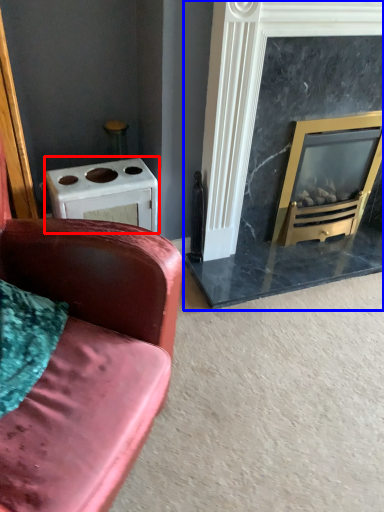
Question: Which object appears farthest to the camera in this image, appliance (highlighted by a red box) or fireplace (highlighted by a blue box)?

Choices:
 (A) appliance
 (B) fireplace

Answer: (A)